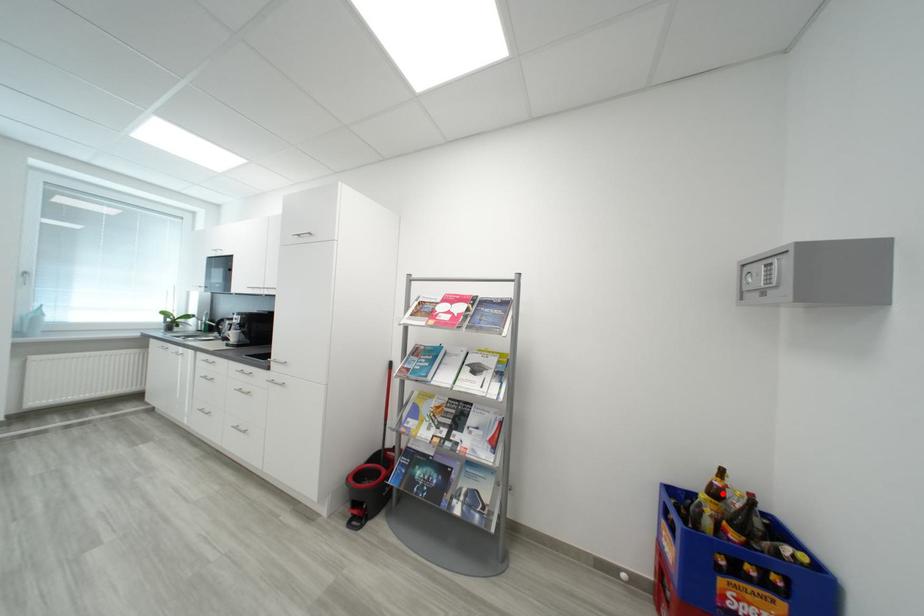
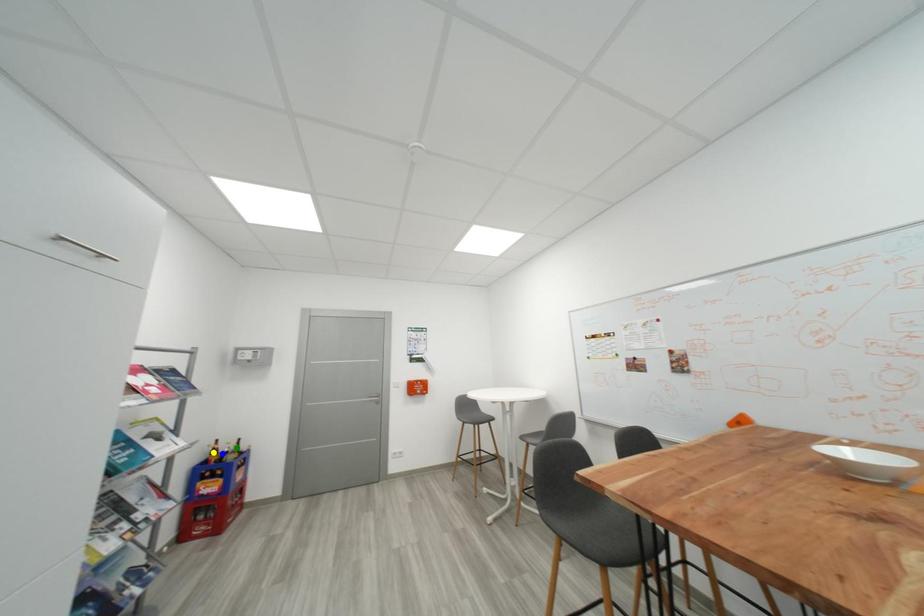
Question: I am providing you with two images of the same scene from different viewpoints. A red point is marked on the first image. You are given multiple points on the second image. Which spot in image 2 lines up with the point in image 1?

Choices:
 (A) blue point
 (B) yellow point
 (C) green point

Answer: (A)